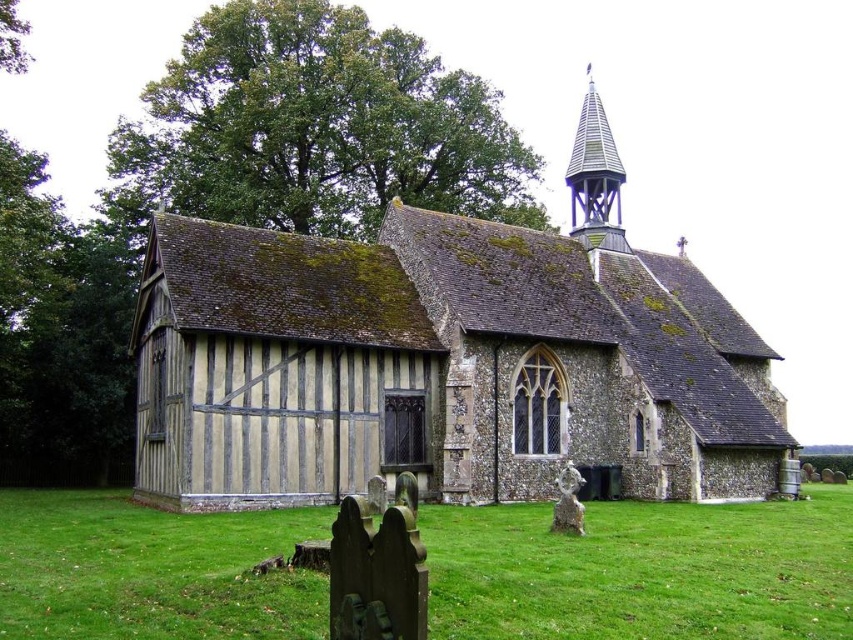
You are standing in front of the historic church and notice the green grass at lower center and the shiny blue spire at upper right. Which object is closer to you?

The green grass at lower center is closer to you since it is not as tall as the shiny blue spire at upper right, indicating its proximity.

You are a painter standing at the edge of the green grass at lower center, planning to paint the wooden planks church at center. Considering the height difference between them, will you need to tilt your head upwards to see the top of the church?

The wooden planks church at center is much taller than the green grass at lower center, so yes, you will need to tilt your head upwards to see the top of the church.